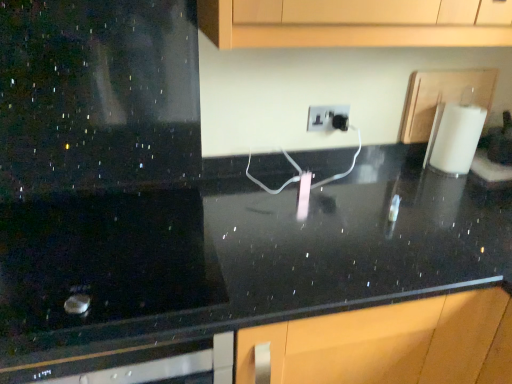
Question: From a real-world perspective, is black polished countertop at center positioned over white matte paper towel at right based on gravity?

Choices:
 (A) no
 (B) yes

Answer: (A)

Question: Is black polished countertop at center to the left of white matte paper towel at right from the viewer's perspective?

Choices:
 (A) no
 (B) yes

Answer: (B)

Question: Can we say black polished countertop at center lies outside white matte paper towel at right?

Choices:
 (A) no
 (B) yes

Answer: (B)

Question: Does black polished countertop at center appear on the right side of white matte paper towel at right?

Choices:
 (A) yes
 (B) no

Answer: (B)

Question: Is black polished countertop at center smaller than white matte paper towel at right?

Choices:
 (A) no
 (B) yes

Answer: (A)

Question: Is black polished countertop at center looking in the opposite direction of white matte paper towel at right?

Choices:
 (A) no
 (B) yes

Answer: (A)

Question: Is white plastic electric outlet at center positioned with its back to black polished countertop at center?

Choices:
 (A) no
 (B) yes

Answer: (A)

Question: Does white plastic electric outlet at center appear on the left side of black polished countertop at center?

Choices:
 (A) no
 (B) yes

Answer: (A)

Question: From a real-world perspective, is white plastic electric outlet at center positioned under black polished countertop at center based on gravity?

Choices:
 (A) yes
 (B) no

Answer: (B)

Question: Can you confirm if white plastic electric outlet at center is wider than black polished countertop at center?

Choices:
 (A) yes
 (B) no

Answer: (B)

Question: From the image's perspective, is white plastic electric outlet at center beneath black polished countertop at center?

Choices:
 (A) no
 (B) yes

Answer: (A)

Question: Is white plastic electric outlet at center completely or partially outside of black polished countertop at center?

Choices:
 (A) yes
 (B) no

Answer: (A)

Question: Is white matte paper towel at right located outside white plastic electric outlet at center?

Choices:
 (A) yes
 (B) no

Answer: (A)